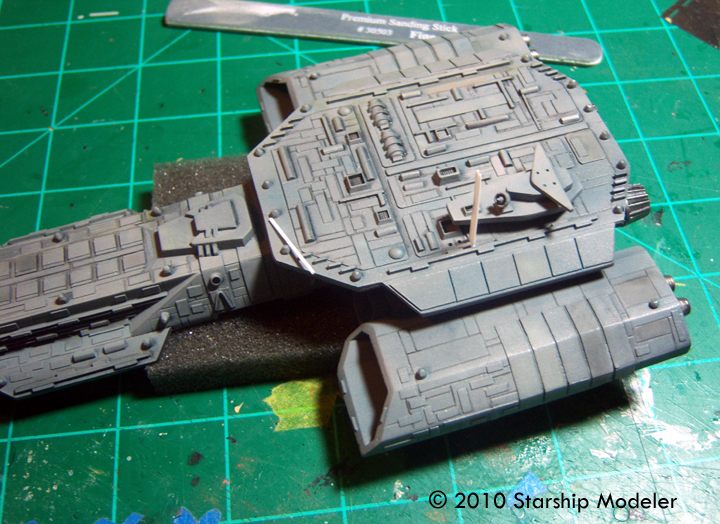
I want to click on silver nail file, so click(x=340, y=13).